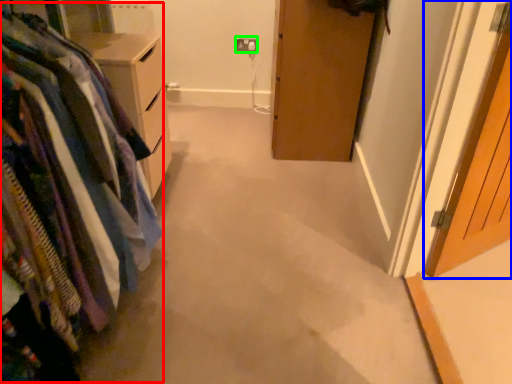
Question: Which object is the closest to the closet (highlighted by a red box)? Choose among these: door (highlighted by a blue box) or electric outlet (highlighted by a green box).

Choices:
 (A) door
 (B) electric outlet

Answer: (A)